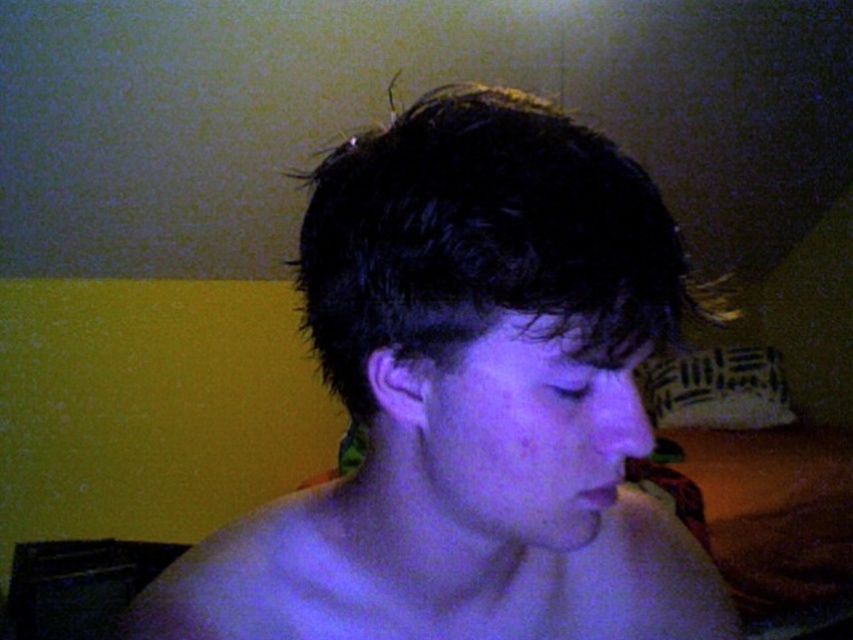
Which of these two, dark matte hair at center or smooth skin at center, stands taller?

dark matte hair at center is taller.

Which is more to the left, dark matte hair at center or smooth skin at center?

dark matte hair at center is more to the left.

Identify the location of dark matte hair at center. (469, 401).

Locate an element on the screen. Image resolution: width=853 pixels, height=640 pixels. dark matte hair at center is located at coordinates (469, 401).